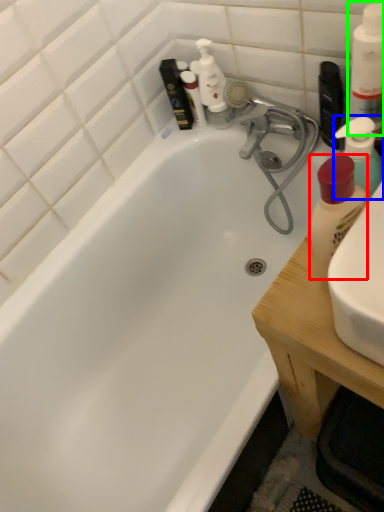
Question: Which object is the farthest from cleaning product (highlighted by a red box)? Choose among these: cleaning product (highlighted by a blue box) or cleaning product (highlighted by a green box).

Choices:
 (A) cleaning product
 (B) cleaning product

Answer: (B)